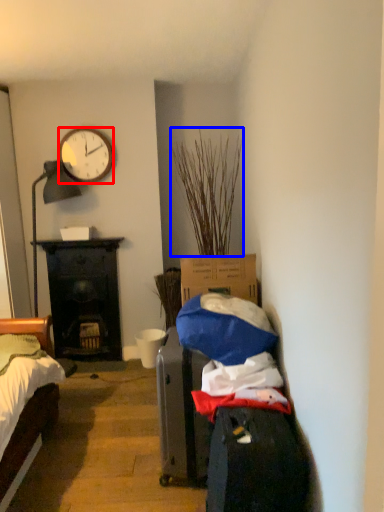
Question: Which point is closer to the camera, clock (highlighted by a red box) or plant (highlighted by a blue box)?

Choices:
 (A) clock
 (B) plant

Answer: (B)